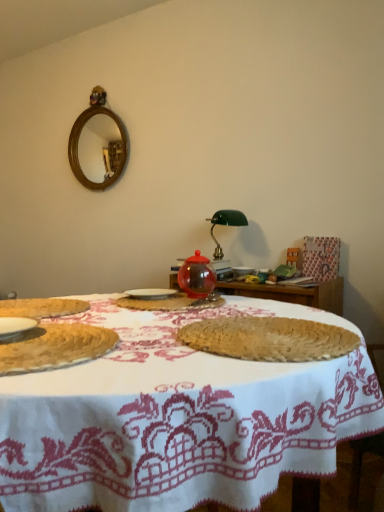
Where is `space that is in front of white ceramic plate at center`? The image size is (384, 512). space that is in front of white ceramic plate at center is located at coordinates (145, 307).